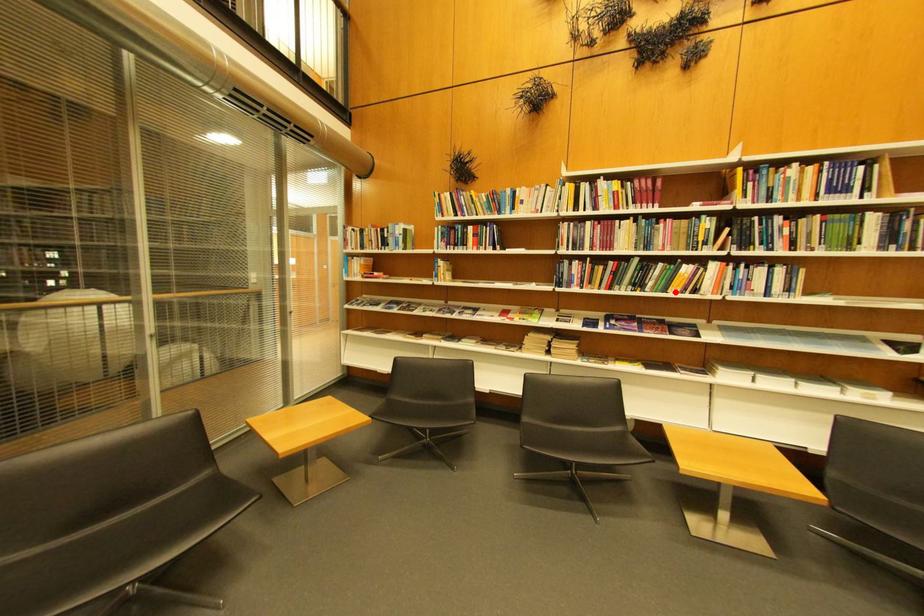
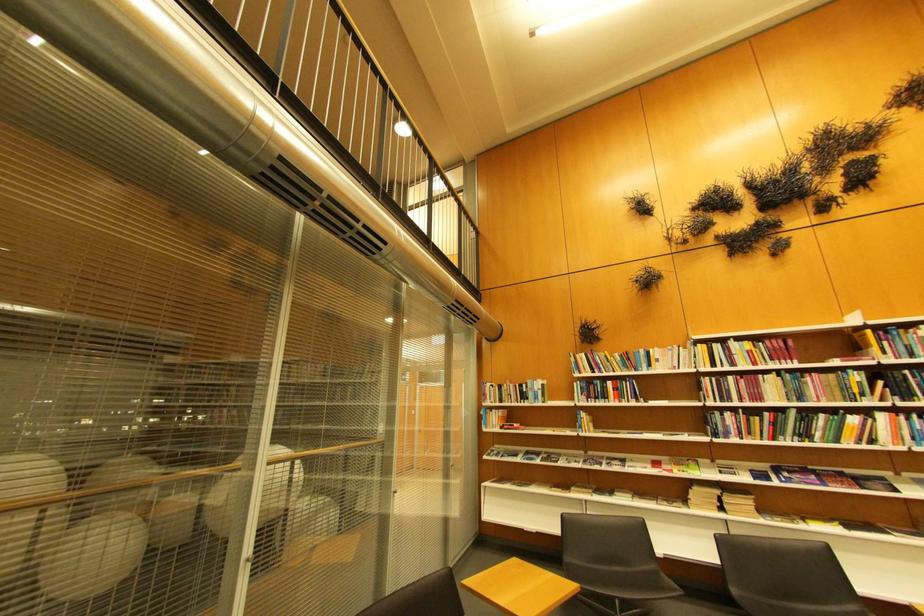
Question: I am providing you with two images of the same scene from different viewpoints. A red point is shown in image1. For the corresponding object point in image2, is it positioned nearer or farther from the camera?

Choices:
 (A) Nearer
 (B) Farther

Answer: (A)